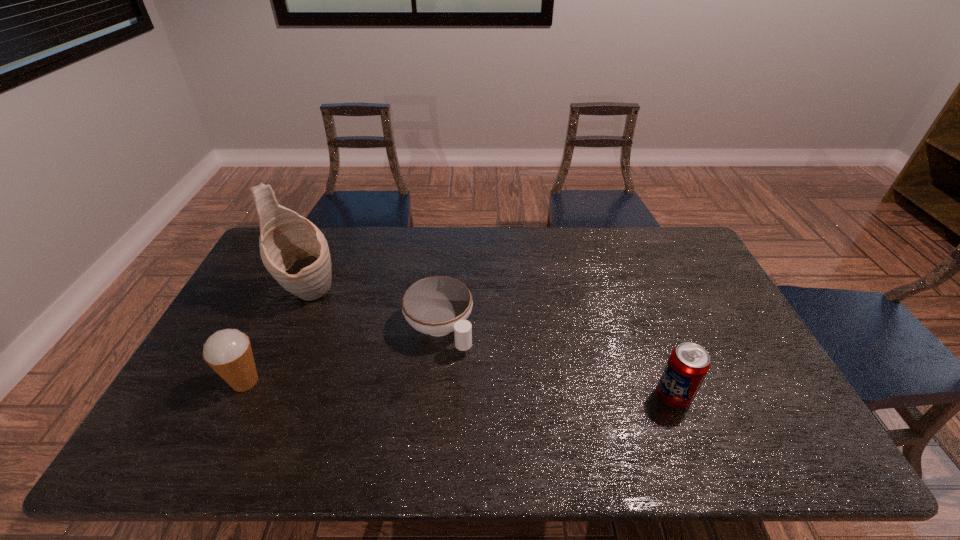
Identify the location of vacant area located at the spout of the tallest object. The image size is (960, 540). (378, 352).

In order to click on free spot located 0.310m at the spout of the tallest object in this screenshot , I will do `click(390, 361)`.

Find the location of a particular element. The image size is (960, 540). free region located at the spout of the tallest object is located at coordinates (365, 341).

Find the location of a particular element. The image size is (960, 540). icecream that is positioned at the near edge is located at coordinates (228, 352).

I want to click on soda can that is at the near edge, so click(688, 364).

Image resolution: width=960 pixels, height=540 pixels. What are the coordinates of `icecream at the left edge` in the screenshot? It's located at (228, 352).

Find the location of a particular element. pitcher present at the left edge is located at coordinates (295, 252).

Locate an element on the screen. object that is at the near left corner is located at coordinates (228, 352).

Find the location of a particular element. The image size is (960, 540). free space at the far edge of the desktop is located at coordinates (472, 236).

I want to click on blank space at the left edge of the desktop, so click(x=263, y=308).